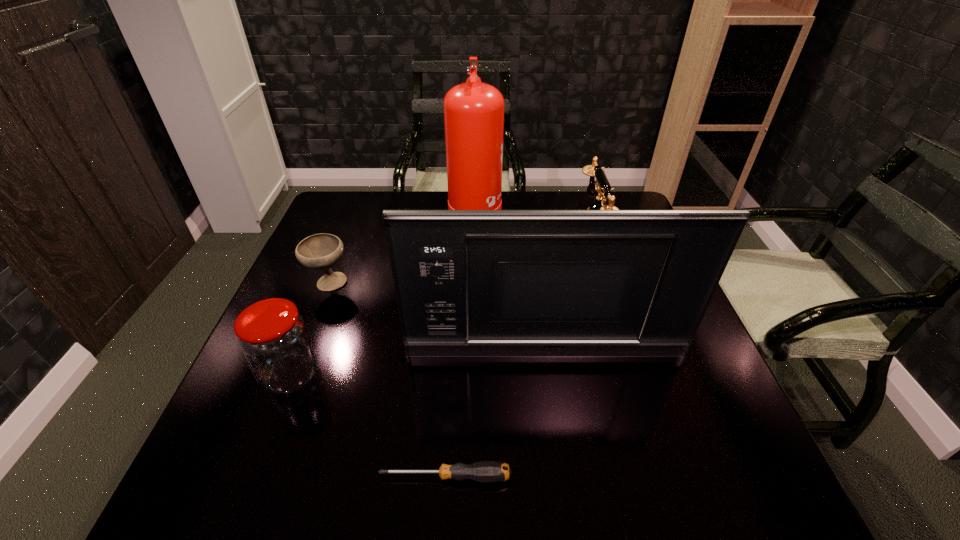
Locate an element on the screen. fire extinguisher is located at coordinates (473, 111).

Identify the location of microwave oven. (468, 282).

In order to click on the third tallest object in this screenshot , I will do `click(602, 186)`.

At what (x,y) coordinates should I click in order to perform the action: click on the fourth tallest object. Please return your answer as a coordinate pair (x, y). This screenshot has height=540, width=960. Looking at the image, I should click on (273, 337).

Where is `chalice`? This screenshot has width=960, height=540. chalice is located at coordinates (321, 251).

Where is `the third farthest object`? Image resolution: width=960 pixels, height=540 pixels. the third farthest object is located at coordinates (321, 251).

This screenshot has height=540, width=960. In order to click on the nearest object in this screenshot , I will do `click(484, 471)`.

Where is `screwdriver`? The width and height of the screenshot is (960, 540). screwdriver is located at coordinates (484, 471).

Locate an element on the screen. The height and width of the screenshot is (540, 960). free space located 0.060m towards the nozzle of the fire extinguisher is located at coordinates (519, 216).

I want to click on vacant space located on the front panel of the microwave oven, so click(x=551, y=400).